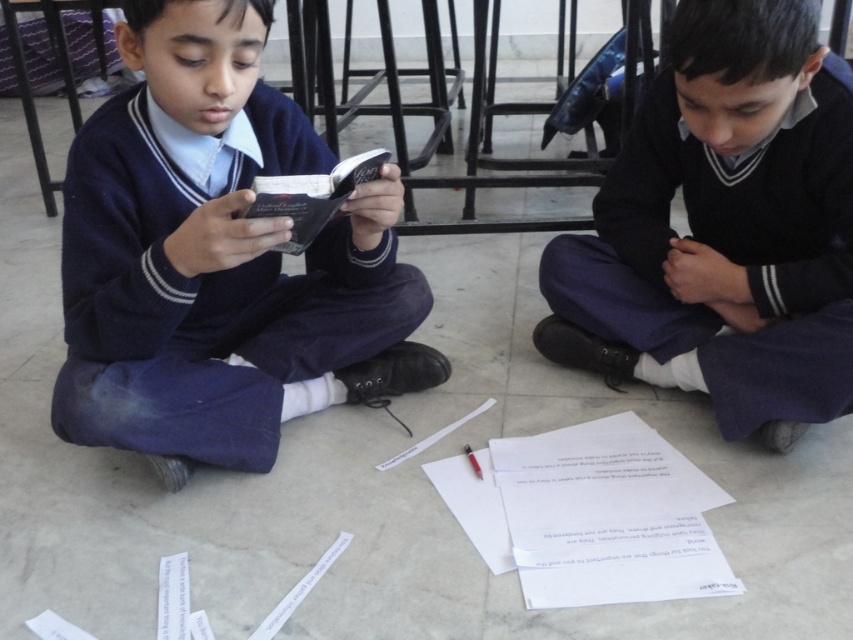
You are a student who needs to place both the matte black book at center and the dark blue sweater at center into a rectangular box. Which object should you place first to ensure they both fit?

The matte black book at center is bigger than the dark blue sweater at center, so you should place the matte black book at center first to ensure both fit into the box.

In the scene shown: You are a teacher observing the two boys in the scene. You need to determine which object, the matte black book at center or the dark blue sweater at center, is wider. Based on the spatial relationship between them, which one has a greater width?

The matte black book at center is wider than the dark blue sweater at center because its width surpasses the sweater.

You are a photographer standing at a point where you can see the two boys and the scattered papers. You want to take a photo that includes both the boy on the left holding the open book and the point at coordinates point (123, 35). Is there enough space between you and the point to fit both subjects in the frame?

The distance between point (123, 35) and the camera is 1.11 meters. Since the photographer is standing at that point, there is sufficient space to include both the boy on the left holding the open book and the point in the frame as they are within the same viewing area.